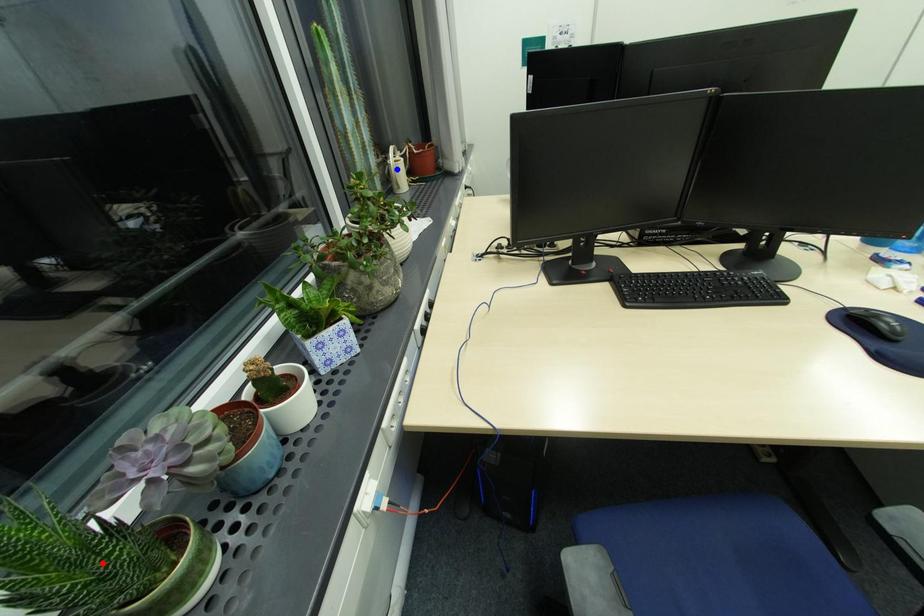
Question: Which of the two points in the image is closer to the camera?

Choices:
 (A) Blue point is closer.
 (B) Red point is closer.

Answer: (B)